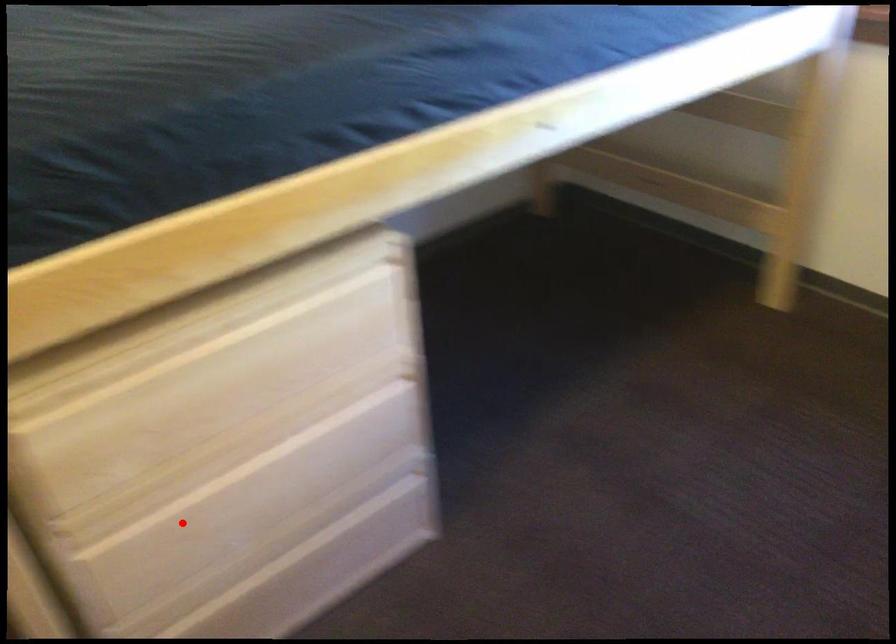
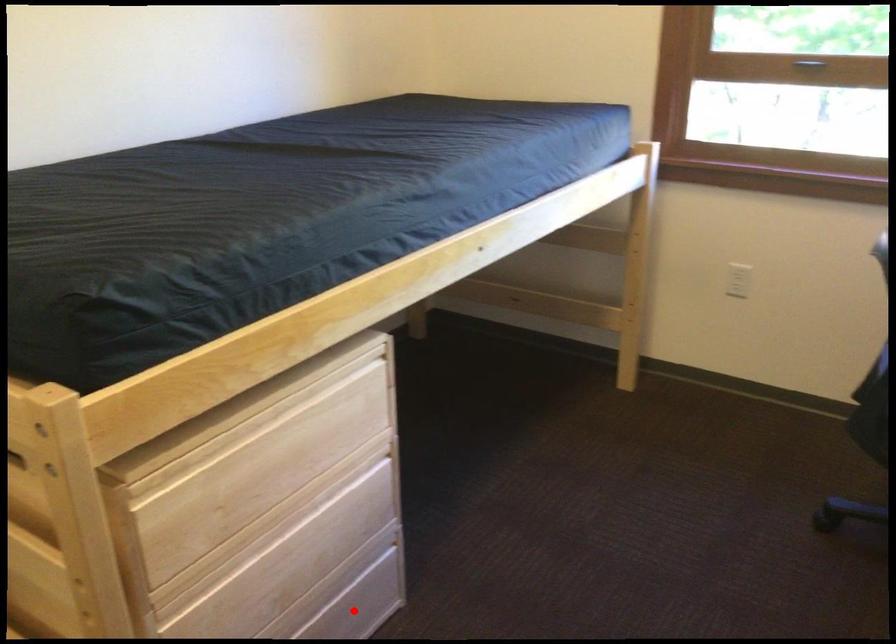
I am providing you with two images of the same scene from different viewpoints. A red point is marked on the first image and another point is marked on the second image. Is the marked point in image1 the same physical position as the marked point in image2?

No